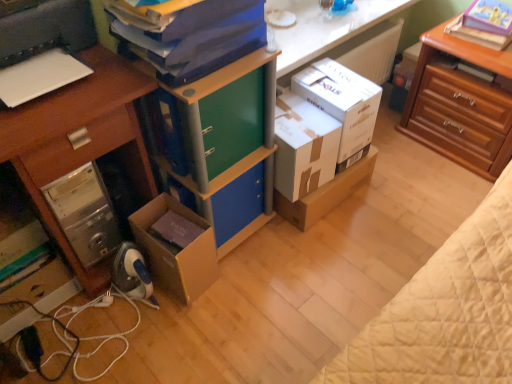
Where is `vacant space in front of cardboard box at lower left, acting as the 3th box starting from the right`? Image resolution: width=512 pixels, height=384 pixels. vacant space in front of cardboard box at lower left, acting as the 3th box starting from the right is located at coordinates (190, 322).